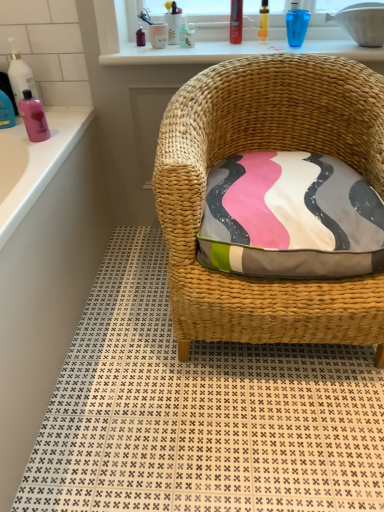
Question: Is point (44, 136) positioned closer to the camera than point (220, 337)?

Choices:
 (A) closer
 (B) farther

Answer: (B)

Question: Is pink glossy bottle at left, the first cleaning product in the right-to-left sequence, bigger or smaller than woven wicker chair at center?

Choices:
 (A) big
 (B) small

Answer: (B)

Question: Estimate the real-world distances between objects in this image. Which object is farther from the shiny plastic tube at upper center, placed as the 3th toiletry when sorted from right to left?

Choices:
 (A) translucent plastic cup at upper right, the 3th toiletry in the left-to-right sequence
 (B) pink plastic bottle at left
 (C) woven wicker chair at center
 (D) textured fabric pillow at center
 (E) translucent plastic bottle at left, which is the 1th cleaning product from left to right

Answer: (B)

Question: Which is nearer to the translucent plastic cup at upper right, the 3th toiletry in the left-to-right sequence?

Choices:
 (A) pink plastic bottle at left
 (B) shiny plastic tube at upper center, placed as the 3th toiletry when sorted from right to left
 (C) woven wicker chair at center
 (D) textured fabric pillow at center
 (E) woven wicker chair at center

Answer: (B)